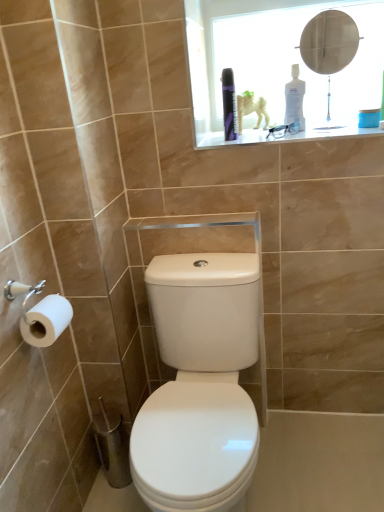
The height and width of the screenshot is (512, 384). I want to click on vacant space behind white plastic bottle at upper center, the second toiletry when ordered from left to right, so click(296, 126).